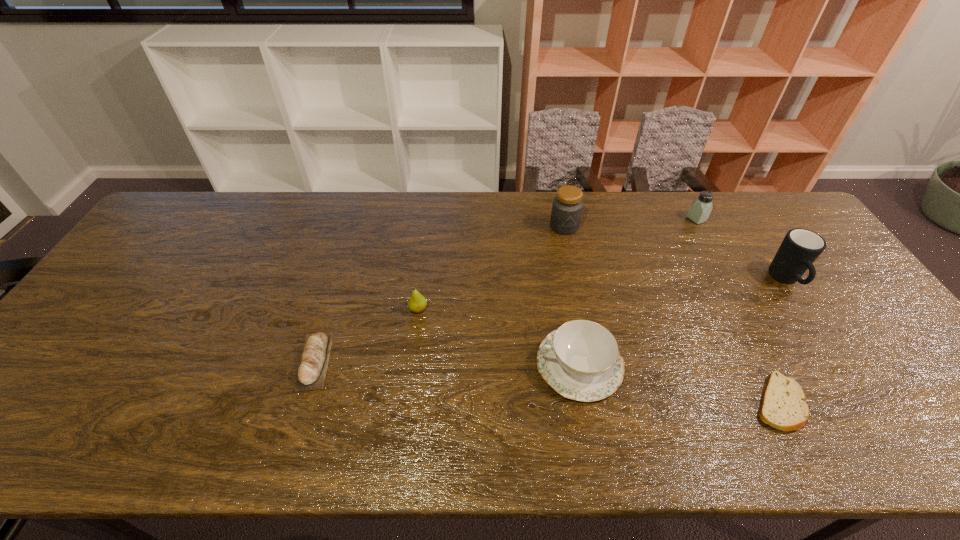
This screenshot has height=540, width=960. In order to click on jar that is at the far edge in this screenshot , I will do `click(567, 206)`.

The height and width of the screenshot is (540, 960). What are the coordinates of `saltshaker that is at the far edge` in the screenshot? It's located at (700, 209).

Identify the location of object that is at the near edge. (783, 406).

Find the location of `object present at the right edge`. object present at the right edge is located at coordinates (800, 248).

Identify the location of vacant space at the far edge of the desktop. The width and height of the screenshot is (960, 540). (538, 211).

In the image, there is a desktop. At what (x,y) coordinates should I click in order to perform the action: click on vacant space at the near edge. Please return your answer as a coordinate pair (x, y). The height and width of the screenshot is (540, 960). Looking at the image, I should click on (518, 441).

Image resolution: width=960 pixels, height=540 pixels. I want to click on free spot at the left edge of the desktop, so click(118, 346).

You are a GUI agent. You are given a task and a screenshot of the screen. Output one action in this format:
    pyautogui.click(x=<x>, y=<y>)
    Task: Click on the vacant space at the far right corner of the desktop
    The width and height of the screenshot is (960, 540).
    Given the screenshot: What is the action you would take?
    pyautogui.click(x=759, y=220)

Image resolution: width=960 pixels, height=540 pixels. In order to click on free spot between the right pita bread and the jar in this screenshot , I will do `click(671, 314)`.

Identify the location of free spot between the jar and the fifth nearest object. (675, 253).